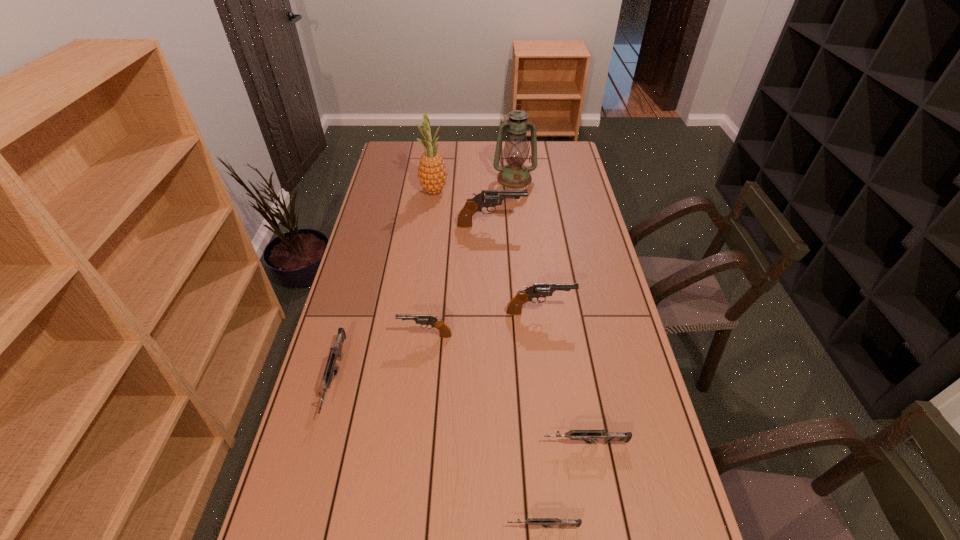
Identify the location of free space located aimed along the barrel of the fourth tallest gun. (307, 485).

This screenshot has width=960, height=540. What are the coordinates of `vacant space located 0.380m aimed along the barrel of the second nearest grey gun` in the screenshot? It's located at (394, 443).

Find the location of a particular element. This screenshot has width=960, height=540. vacant space located 0.230m aimed along the barrel of the second nearest grey gun is located at coordinates (453, 443).

Locate an element on the screen. The height and width of the screenshot is (540, 960). blank area located aimed along the barrel of the second nearest grey gun is located at coordinates 402,443.

Locate an element on the screen. vacant space situated 0.200m aimed along the barrel of the nearest gun is located at coordinates (418, 526).

Find the location of `vacant space situated aimed along the barrel of the nearest gun`. vacant space situated aimed along the barrel of the nearest gun is located at coordinates (404, 526).

Identify the location of free space located 0.320m aimed along the barrel of the nearest gun. This screenshot has height=540, width=960. (364, 526).

Locate an element on the screen. This screenshot has height=540, width=960. object situated at the left edge is located at coordinates (335, 353).

Where is `free location at the far edge`? Image resolution: width=960 pixels, height=540 pixels. free location at the far edge is located at coordinates (456, 163).

You are a GUI agent. You are given a task and a screenshot of the screen. Output one action in this format:
    pyautogui.click(x=<x>, y=<y>)
    Task: Click on the free region at the left edge of the desktop
    This screenshot has width=960, height=540.
    Given the screenshot: What is the action you would take?
    pyautogui.click(x=341, y=453)